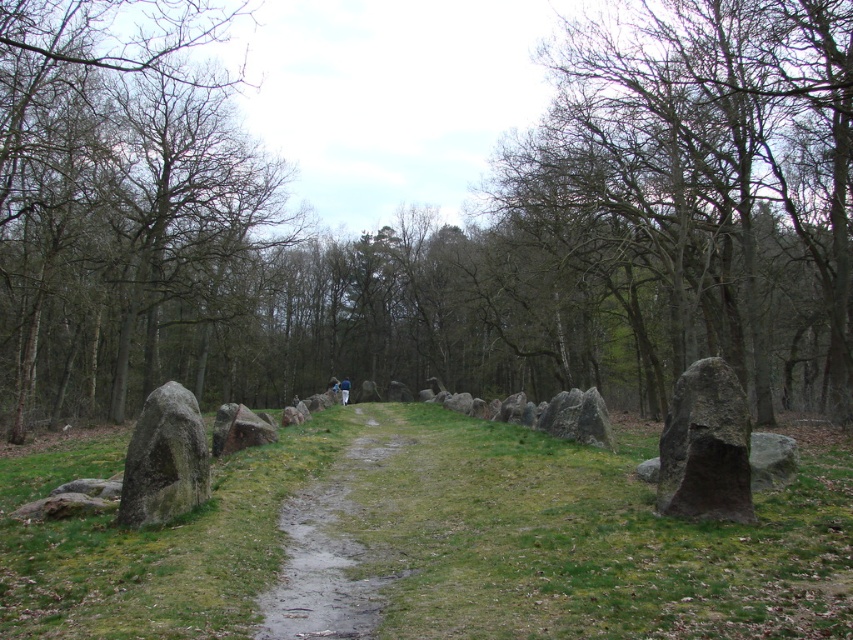
Does smooth stone forest at center appear under blue fabric person at center?

A: Actually, smooth stone forest at center is above blue fabric person at center.

Which is in front, point (566, 378) or point (340, 384)?

Point (566, 378)

You are a GUI agent. You are given a task and a screenshot of the screen. Output one action in this format:
    pyautogui.click(x=<x>, y=<y>)
    Task: Click on the smooth stone forest at center
    The image size is (853, 640).
    Given the screenshot: What is the action you would take?
    pyautogui.click(x=430, y=221)

Is smooth brown tree trunk at left to the left of gray stone boulder at center from the viewer's perspective?

Yes, smooth brown tree trunk at left is to the left of gray stone boulder at center.

At what (x,y) coordinates should I click in order to perform the action: click on smooth brown tree trunk at left. Please return your answer as a coordinate pair (x, y). Looking at the image, I should click on (120, 200).

Can you confirm if dark gray stone at right is thinner than gray stone boulder at left?

Indeed, dark gray stone at right has a lesser width compared to gray stone boulder at left.

Where is `dark gray stone at right`? dark gray stone at right is located at coordinates (705, 445).